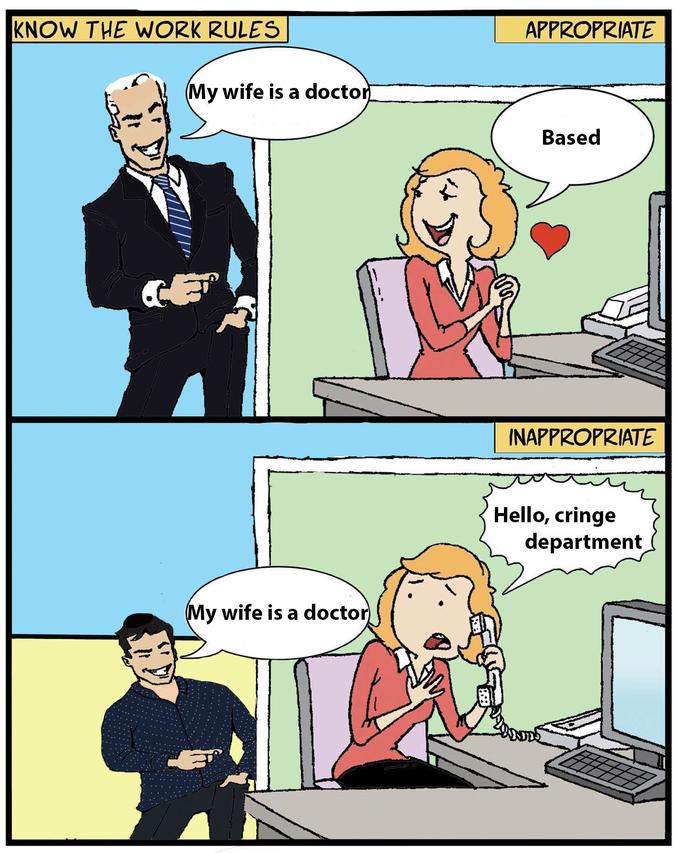
This screenshot has width=680, height=853. Identify the location of chalk board. (335, 519), (307, 263).